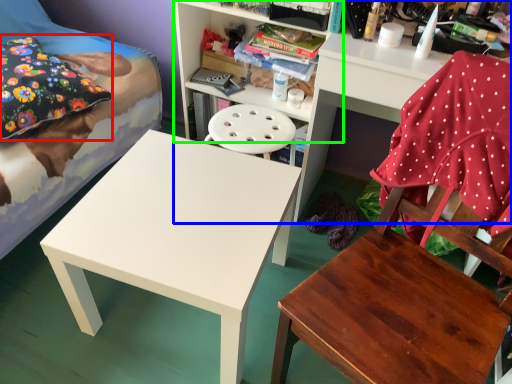
Question: Considering the real-world distances, which object is farthest from pillow (highlighted by a red box)? shelf (highlighted by a blue box) or shelf (highlighted by a green box)?

Choices:
 (A) shelf
 (B) shelf

Answer: (A)